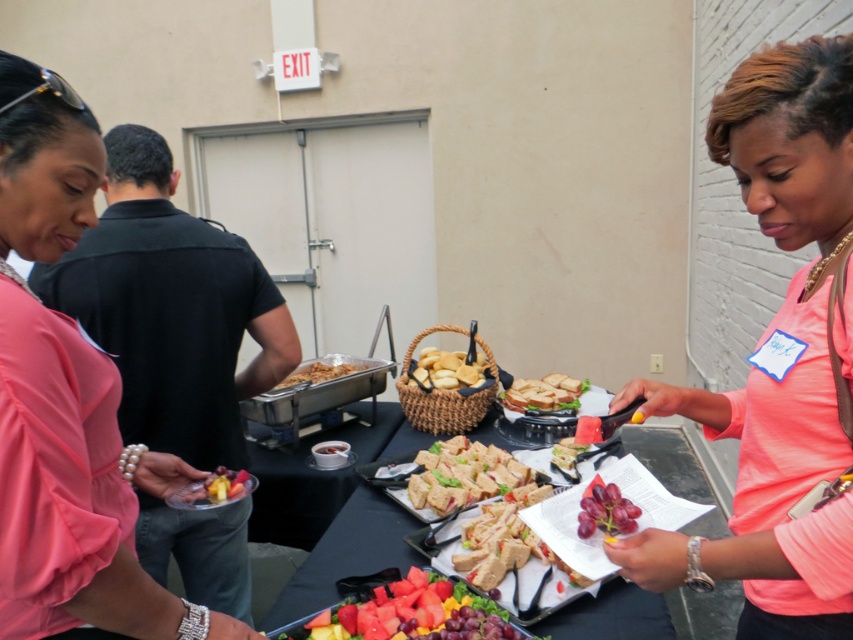
Question: Is pink matte shirt at center wider than matte white sandwiches at center?

Choices:
 (A) yes
 (B) no

Answer: (B)

Question: Estimate the real-world distances between objects in this image. Which object is closer to the pink matte shirt at center?

Choices:
 (A) juicy watermelon at center
 (B) white bread sandwich at center
 (C) golden brown bread at center
 (D) pink fabric shirt at left

Answer: (A)

Question: Which of the following is the farthest from the observer?

Choices:
 (A) sliced white bread at center
 (B) matte silver platter at center
 (C) white bread sandwich at center

Answer: (C)

Question: Based on their relative distances, which object is nearer to the juicy watermelon at center?

Choices:
 (A) pink fabric shirt at left
 (B) matte silver platter at center

Answer: (A)

Question: Does golden brown bread at center appear under white bread sandwich at center?

Choices:
 (A) no
 (B) yes

Answer: (A)

Question: Does golden brown bread at center have a lesser width compared to matte silver platter at center?

Choices:
 (A) yes
 (B) no

Answer: (B)